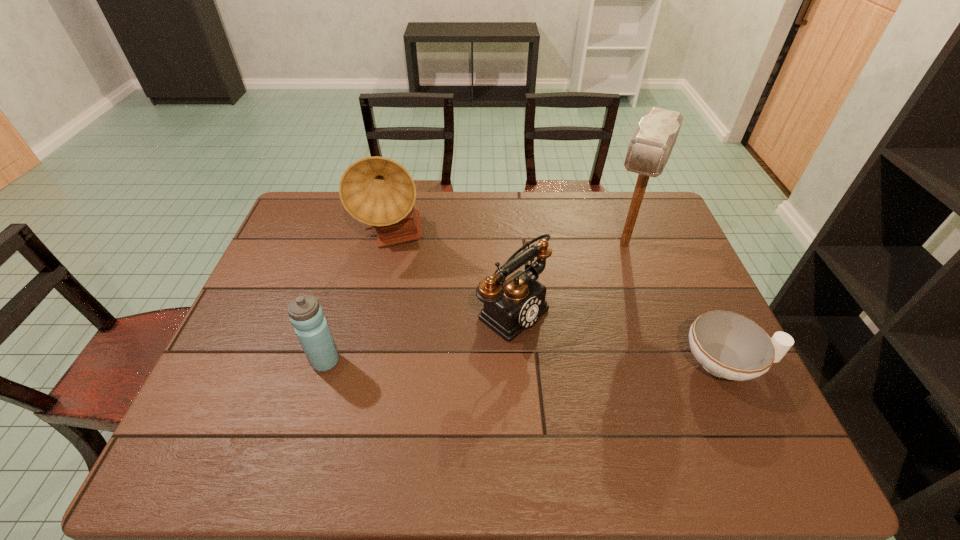
Identify the location of water bottle. The image size is (960, 540). (306, 315).

Find the location of a particular element. The width and height of the screenshot is (960, 540). the shortest object is located at coordinates (728, 345).

The width and height of the screenshot is (960, 540). I want to click on the fourth shortest object, so click(x=377, y=191).

This screenshot has height=540, width=960. Find the location of `the third object from left to right`. the third object from left to right is located at coordinates (510, 306).

Where is `mallet`? mallet is located at coordinates (650, 147).

Locate an element on the screen. vacant space situated 0.370m on the right of the water bottle is located at coordinates coord(486,361).

I want to click on vacant area situated 0.370m on the horn of the phonograph record, so point(488,333).

Find the location of a particular element. The image size is (960, 540). free space located on the horn of the phonograph record is located at coordinates (434, 281).

Identify the location of free space located 0.130m on the horn of the phonograph record. This screenshot has width=960, height=540. (436, 283).

What are the coordinates of `vacant space located 0.210m on the front of the third object from right to left at the rotary dial` in the screenshot? It's located at (607, 382).